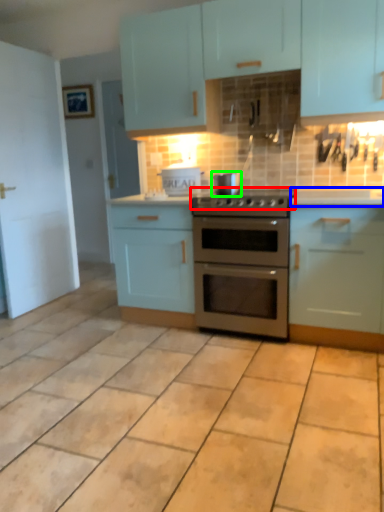
Question: Which object is positioned farthest from gas stove (highlighted by a red box)? Select from counter top (highlighted by a blue box) and appliance (highlighted by a green box).

Choices:
 (A) counter top
 (B) appliance

Answer: (A)